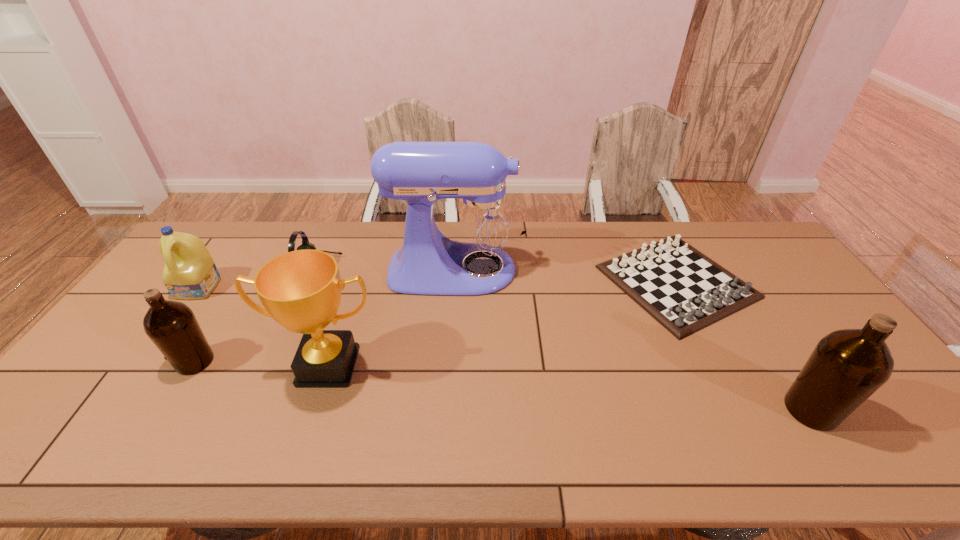
Locate an element on the screen. This screenshot has height=540, width=960. vacant space at the right edge of the desktop is located at coordinates (804, 338).

The width and height of the screenshot is (960, 540). Identify the location of vacant region at the far left corner of the desktop. (221, 244).

Identify the location of free area in between the left olive oil and the sixth tallest object. (256, 315).

You are a GUI agent. You are given a task and a screenshot of the screen. Output one action in this format:
    pyautogui.click(x=<x>, y=<y>)
    Task: Click on the free space that is in between the award and the leftmost object
    This screenshot has width=960, height=540.
    Given the screenshot: What is the action you would take?
    pyautogui.click(x=263, y=327)

This screenshot has width=960, height=540. Find the location of `free space between the detergent and the taller olive oil`. free space between the detergent and the taller olive oil is located at coordinates (505, 349).

Image resolution: width=960 pixels, height=540 pixels. Identify the location of empty location between the left olive oil and the sixth tallest object. click(x=256, y=315).

You are a GUI agent. You are given a task and a screenshot of the screen. Output one action in this format:
    pyautogui.click(x=<x>, y=<y>)
    Task: Click on the vacant space that's between the headset and the shorter olive oil
    The height and width of the screenshot is (540, 960).
    Given the screenshot: What is the action you would take?
    point(256,315)

Select which object is the sixth closest to the detergent. Please provide its 2D coordinates. Your answer should be formatted as a tuple, i.e. [(x, y)], where the tuple contains the x and y coordinates of a point satisfying the conditions above.

[(847, 366)]

Identify the location of object that stands as the third closest to the shortest object. (301, 290).

Where is `vacant space that satisfies the following two spatial constraints: 1. at the mixing area of the tallest object; 2. on the right side of the shortest object`? vacant space that satisfies the following two spatial constraints: 1. at the mixing area of the tallest object; 2. on the right side of the shortest object is located at coordinates (456, 282).